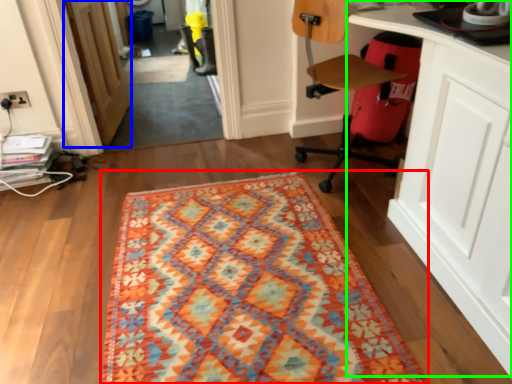
Question: Considering the real-world distances, which object is closest to mat (highlighted by a red box)? door (highlighted by a blue box) or computer desk (highlighted by a green box).

Choices:
 (A) door
 (B) computer desk

Answer: (B)